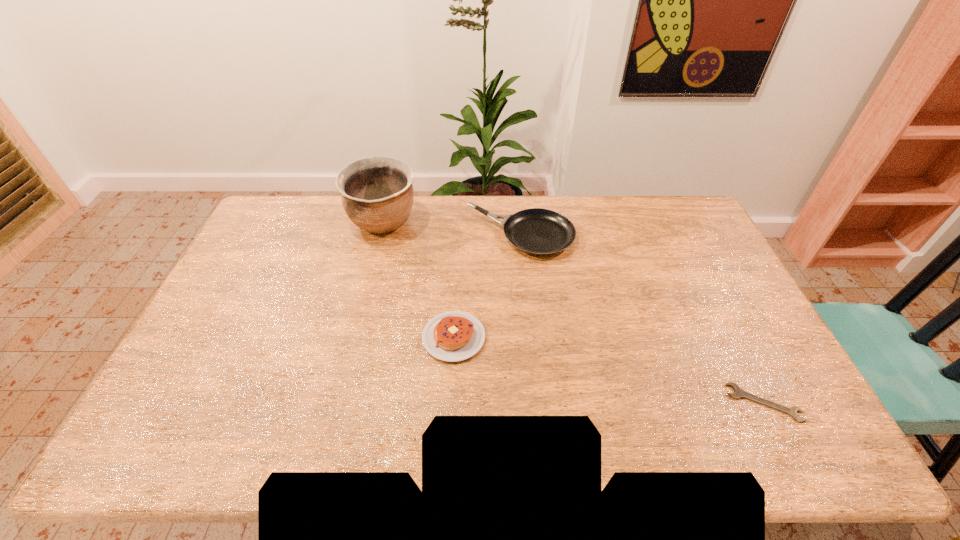
At what (x,y) coordinates should I click in order to perform the action: click on the leftmost object. Please return your answer as a coordinate pair (x, y). The width and height of the screenshot is (960, 540). Looking at the image, I should click on (377, 194).

You are a GUI agent. You are given a task and a screenshot of the screen. Output one action in this format:
    pyautogui.click(x=<x>, y=<y>)
    Task: Click on the pottery
    The image size is (960, 540).
    Given the screenshot: What is the action you would take?
    pyautogui.click(x=377, y=194)

Where is `the second tallest object`? Image resolution: width=960 pixels, height=540 pixels. the second tallest object is located at coordinates (536, 231).

Where is `pancake`? pancake is located at coordinates (452, 336).

You are a GUI agent. You are given a task and a screenshot of the screen. Output one action in this format:
    pyautogui.click(x=<x>, y=<y>)
    Task: Click on the third farthest object
    This screenshot has width=960, height=540.
    Given the screenshot: What is the action you would take?
    pyautogui.click(x=452, y=336)

Locate an element on the screen. the shortest object is located at coordinates (738, 392).

The image size is (960, 540). What are the coordinates of `the nearest object` in the screenshot? It's located at (738, 392).

This screenshot has height=540, width=960. I want to click on blank space located 0.160m on the front of the tallest object, so click(370, 279).

Locate an element on the screen. This screenshot has height=540, width=960. free space located on the left of the second tallest object is located at coordinates (394, 236).

The image size is (960, 540). I want to click on vacant space located 0.140m on the back of the second nearest object, so click(x=457, y=280).